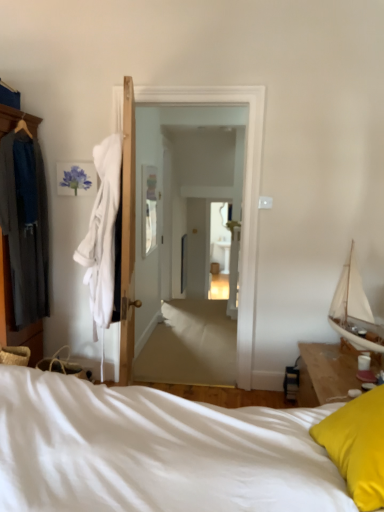
The width and height of the screenshot is (384, 512). What do you see at coordinates (13, 312) in the screenshot? I see `dark gray fabric robe at left` at bounding box center [13, 312].

What do you see at coordinates (155, 451) in the screenshot? I see `white soft bed at lower right` at bounding box center [155, 451].

Describe the element at coordinates (102, 238) in the screenshot. The image size is (384, 512). I see `white soft robe at left` at that location.

The image size is (384, 512). Find the location of `white sailboat at right`. white sailboat at right is located at coordinates (354, 308).

This screenshot has height=512, width=384. Find the location of `dark gray fabric robe at left`. dark gray fabric robe at left is located at coordinates (13, 312).

From a real-world perspective, between white soft bed at lower right and white soft robe at left, who is vertically lower?

From a 3D spatial view, white soft bed at lower right is below.

How distant is white soft bed at lower right from white soft robe at left?

white soft bed at lower right and white soft robe at left are 4.12 feet apart from each other.

Considering the sizes of objects white soft bed at lower right and white soft robe at left in the image provided, who is thinner, white soft bed at lower right or white soft robe at left?

white soft robe at left is thinner.

Is white soft bed at lower right turned away from white soft robe at left?

That's not correct — white soft bed at lower right is not looking away from white soft robe at left.

Measure the distance from white glossy door at center to white soft bed at lower right.

white glossy door at center is 1.82 meters away from white soft bed at lower right.

Is white glossy door at center positioned with its back to white soft bed at lower right?

No.

From the picture: Considering the relative sizes of white glossy door at center and white soft bed at lower right in the image provided, is white glossy door at center thinner than white soft bed at lower right?

Yes.

Which is more to the right, white glossy door at center or white soft bed at lower right?

white glossy door at center.

Based on the photo, is dark gray fabric robe at left facing towards white glossy door at center?

Yes.

Which is behind, dark gray fabric robe at left or white glossy door at center?

white glossy door at center.

From a real-world perspective, is dark gray fabric robe at left located beneath white glossy door at center?

No, from a real-world perspective, dark gray fabric robe at left is not beneath white glossy door at center.

Is dark gray fabric robe at left far away from white glossy door at center?

That's right, there is a large distance between dark gray fabric robe at left and white glossy door at center.

Which is more distant, (343, 316) or (341, 466)?

The point (343, 316) is farther.

From a real-world perspective, is white sailboat at right above or below yellow fabric pillow at lower right?

In terms of real-world spatial position, white sailboat at right is above yellow fabric pillow at lower right.

From the image's perspective, is white sailboat at right under yellow fabric pillow at lower right?

Actually, white sailboat at right appears above yellow fabric pillow at lower right in the image.

The image size is (384, 512). I want to click on pillow that is on the left side of white sailboat at right, so click(x=357, y=446).

Considering the relative sizes of yellow fabric pillow at lower right and white sailboat at right in the image provided, is yellow fabric pillow at lower right smaller than white sailboat at right?

Correct, yellow fabric pillow at lower right occupies less space than white sailboat at right.

From the picture: From a real-world perspective, is yellow fabric pillow at lower right on top of white sailboat at right?

No, from a real-world perspective, yellow fabric pillow at lower right is not above white sailboat at right.

Based on the photo, which object is positioned more to the left, yellow fabric pillow at lower right or white sailboat at right?

From the viewer's perspective, yellow fabric pillow at lower right appears more on the left side.

From the image's perspective, is yellow fabric pillow at lower right above or below white sailboat at right?

yellow fabric pillow at lower right is situated lower than white sailboat at right in the image.

Which point is more forward, (28,329) or (91,307)?

Positioned in front is point (28,329).

Is dark gray fabric robe at left directly adjacent to white soft robe at left?

No, dark gray fabric robe at left is not with white soft robe at left.

From the picture: From a real-world perspective, which object stands above the other?

dark gray fabric robe at left.

Based on the photo, from their relative heights in the image, would you say dark gray fabric robe at left is taller or shorter than white sailboat at right?

Considering their sizes, dark gray fabric robe at left has more height than white sailboat at right.

From the image's perspective, does dark gray fabric robe at left appear lower than white sailboat at right?

Incorrect, from the image's perspective, dark gray fabric robe at left is higher than white sailboat at right.

Considering the positions of objects dark gray fabric robe at left and white sailboat at right in the image provided, who is more to the right, dark gray fabric robe at left or white sailboat at right?

From the viewer's perspective, white sailboat at right appears more on the right side.

Where is `clothing behind the white soft bed at lower right`? clothing behind the white soft bed at lower right is located at coordinates (102, 238).

Where is `bed below the white glossy door at center (from a real-world perspective)`? bed below the white glossy door at center (from a real-world perspective) is located at coordinates (155, 451).

Which object lies nearer to the anchor point dark gray fabric robe at left, white soft bed at lower right or yellow fabric pillow at lower right?

white soft bed at lower right lies closer to dark gray fabric robe at left than the other object.

When comparing their distances from white soft bed at lower right, does yellow fabric pillow at lower right or white soft robe at left seem closer?

yellow fabric pillow at lower right is closer to white soft bed at lower right.

Based on their spatial positions, is white soft robe at left or yellow fabric pillow at lower right closer to dark gray fabric robe at left?

Among the two, white soft robe at left is located nearer to dark gray fabric robe at left.

Which object lies nearer to the anchor point white glossy door at center, white soft bed at lower right or white sailboat at right?

white sailboat at right lies closer to white glossy door at center than the other object.

From the image, which object appears to be farther from white soft bed at lower right, white glossy door at center or white sailboat at right?

Among the two, white glossy door at center is located further to white soft bed at lower right.

Based on their spatial positions, is yellow fabric pillow at lower right or white sailboat at right further from dark gray fabric robe at left?

Among the two, yellow fabric pillow at lower right is located further to dark gray fabric robe at left.

Considering their positions, is white soft bed at lower right positioned further to white soft robe at left than yellow fabric pillow at lower right?

Among the two, yellow fabric pillow at lower right is located further to white soft robe at left.

Estimate the real-world distances between objects in this image. Which object is closer to white soft robe at left, white glossy door at center or dark gray fabric robe at left?

Based on the image, dark gray fabric robe at left appears to be nearer to white soft robe at left.

The height and width of the screenshot is (512, 384). In order to click on boat between white soft bed at lower right and white glossy door at center in the front-back direction in this screenshot , I will do `click(354, 308)`.

Find the location of a particular element. This screenshot has height=512, width=384. boat between white soft bed at lower right and white soft robe at left along the z-axis is located at coordinates pyautogui.click(x=354, y=308).

Find the location of a particular element. screen door between dark gray fabric robe at left and white sailboat at right is located at coordinates (x=243, y=193).

Where is `clothing between white soft bed at lower right and white glossy door at center from front to back`? clothing between white soft bed at lower right and white glossy door at center from front to back is located at coordinates (102, 238).